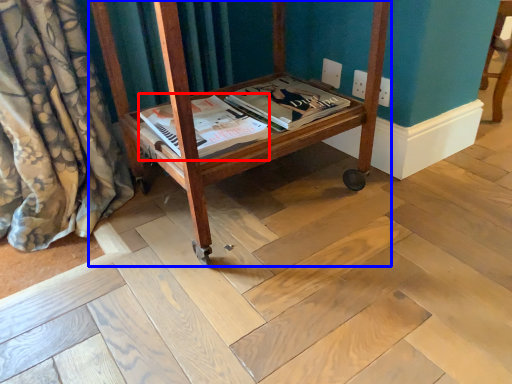
Question: Which of the following is the farthest to the observer, magazine (highlighted by a red box) or furniture (highlighted by a blue box)?

Choices:
 (A) magazine
 (B) furniture

Answer: (A)